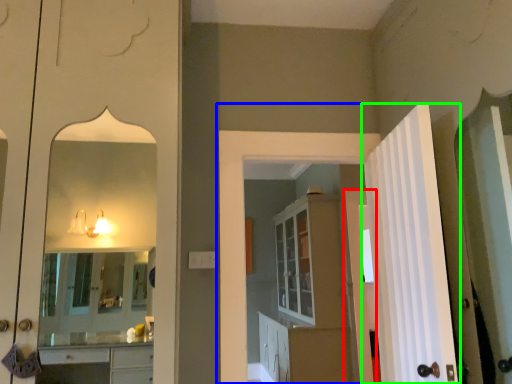
Question: Considering the real-world distances, which object is closest to door (highlighted by a red box)? door (highlighted by a blue box) or door (highlighted by a green box).

Choices:
 (A) door
 (B) door

Answer: (A)